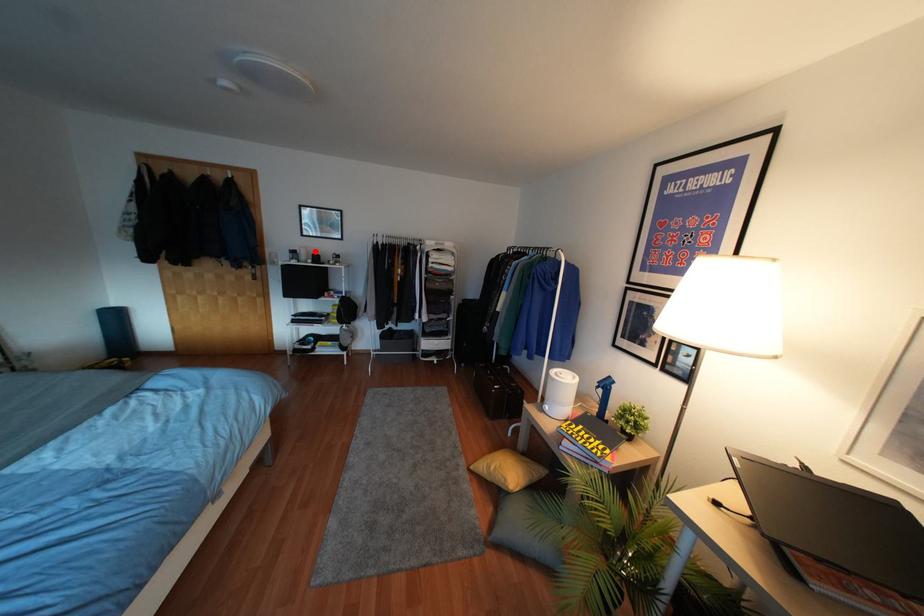
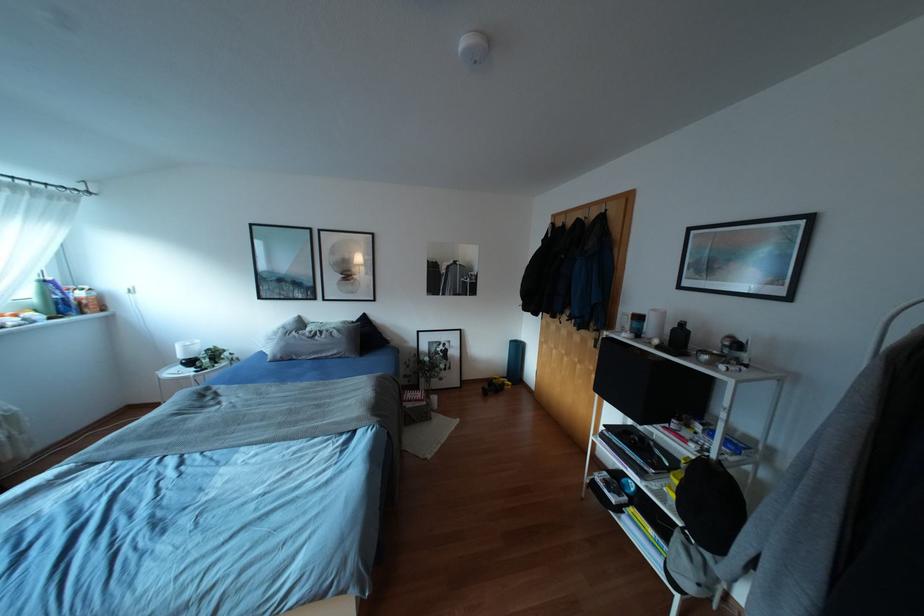
In the second image, find the point that corresponds to the highlighted location in the first image.

(682, 323)